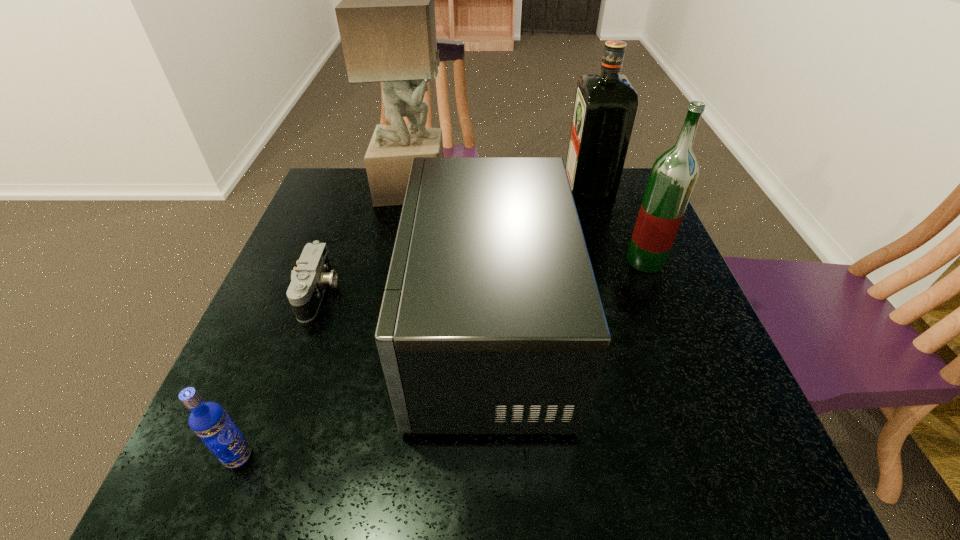
This screenshot has height=540, width=960. I want to click on vodka that is at the left edge, so click(209, 421).

This screenshot has height=540, width=960. In order to click on camera located at the left edge in this screenshot , I will do `click(309, 280)`.

The width and height of the screenshot is (960, 540). I want to click on object present at the near left corner, so click(209, 421).

Locate an element on the screen. Image resolution: width=960 pixels, height=540 pixels. object at the far right corner is located at coordinates (605, 108).

Image resolution: width=960 pixels, height=540 pixels. I want to click on vacant space at the far edge of the desktop, so [x=381, y=206].

Where is `free space at the near edge`? free space at the near edge is located at coordinates (409, 492).

What are the coordinates of `vacant area at the left edge` in the screenshot? It's located at (255, 322).

At what (x,y) coordinates should I click in order to perform the action: click on vacant space at the right edge of the desktop. Please return your answer as a coordinate pair (x, y). This screenshot has width=960, height=540. Looking at the image, I should click on [x=676, y=294].

Locate an element on the screen. The height and width of the screenshot is (540, 960). vacant space at the far left corner is located at coordinates (342, 176).

What are the coordinates of `vacant space at the far right corner of the desktop` in the screenshot? It's located at (630, 199).